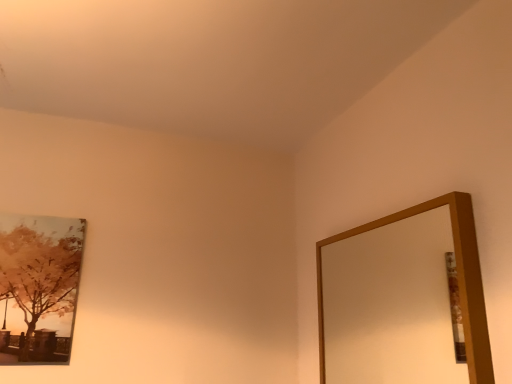
Describe the element at coordinates (391, 304) in the screenshot. This screenshot has height=384, width=512. I see `wooden-framed mirror at upper right` at that location.

This screenshot has height=384, width=512. I want to click on wooden-framed mirror at upper right, so click(x=391, y=304).

Measure the distance between wooden-framed mirror at upper right and camera.

wooden-framed mirror at upper right is 1.78 meters from camera.

What are the coordinates of `wooden-framed mirror at upper right` in the screenshot? It's located at (391, 304).